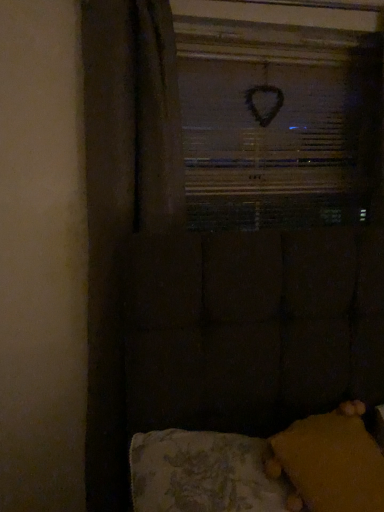
Question: In the image, is yellow fuzzy pillow at lower right positioned in front of or behind velvet yellow cushion at lower right?

Choices:
 (A) front
 (B) behind

Answer: (B)

Question: From a real-world perspective, is yellow fuzzy pillow at lower right above or below velvet yellow cushion at lower right?

Choices:
 (A) above
 (B) below

Answer: (A)

Question: Estimate the real-world distances between objects in this image. Which object is closer to the yellow fuzzy pillow at lower right?

Choices:
 (A) velvet yellow cushion at lower right
 (B) black matte heart at upper center

Answer: (A)

Question: Which object is the farthest from the velvet yellow cushion at lower right?

Choices:
 (A) black matte heart at upper center
 (B) yellow fuzzy pillow at lower right

Answer: (A)